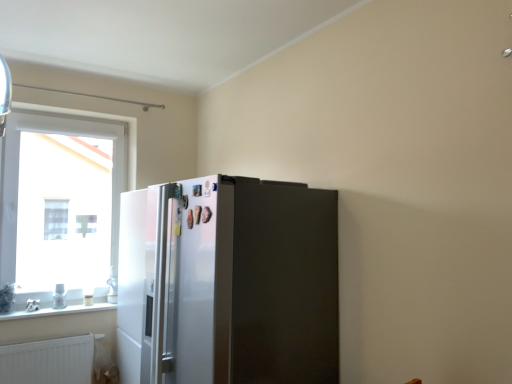
Question: From a real-world perspective, is satin silver refrigerator at center physically located above or below clear glass window at left?

Choices:
 (A) above
 (B) below

Answer: (B)

Question: Considering their positions, is satin silver refrigerator at center located in front of or behind clear glass window at left?

Choices:
 (A) behind
 (B) front

Answer: (B)

Question: Estimate the real-world distances between objects in this image. Which object is farther from the satin silver refrigerator at center?

Choices:
 (A) clear glass window at left
 (B) white glossy window sill at lower left
 (C) white matte radiator at lower left

Answer: (A)

Question: Considering the real-world distances, which object is farthest from the white matte radiator at lower left?

Choices:
 (A) white glossy window sill at lower left
 (B) clear glass window at left
 (C) satin silver refrigerator at center

Answer: (C)